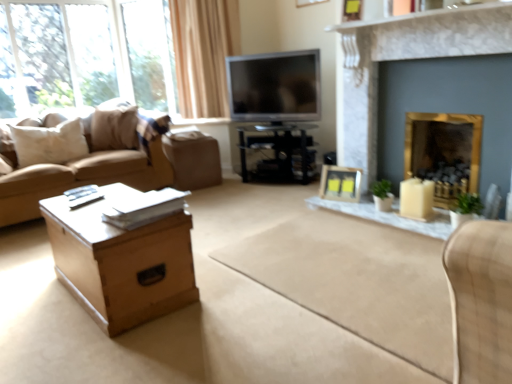
Question: From a real-world perspective, is black glossy tv stand at center, the 1th table in the back-to-front sequence, below light brown wooden table at lower left, which is the second table from top to bottom?

Choices:
 (A) yes
 (B) no

Answer: (B)

Question: Considering the relative sizes of black glossy tv stand at center, acting as the 2th table starting from the left, and light brown wooden table at lower left, marked as the 2th table in a right-to-left arrangement, in the image provided, is black glossy tv stand at center, acting as the 2th table starting from the left, shorter than light brown wooden table at lower left, marked as the 2th table in a right-to-left arrangement,?

Choices:
 (A) no
 (B) yes

Answer: (A)

Question: Does black glossy tv stand at center, the 1th table from the top, have a smaller size compared to light brown wooden table at lower left, which is the first table in bottom-to-top order?

Choices:
 (A) yes
 (B) no

Answer: (B)

Question: Is black glossy tv stand at center, the 1th table positioned from the right, wider than light brown wooden table at lower left, which is the second table from top to bottom?

Choices:
 (A) yes
 (B) no

Answer: (A)

Question: Does black glossy tv stand at center, the 2th table in the bottom-to-top sequence, come in front of light brown wooden table at lower left, marked as the first table in a front-to-back arrangement?

Choices:
 (A) yes
 (B) no

Answer: (B)

Question: From a real-world perspective, is black glossy tv stand at center, the 1th table in the back-to-front sequence, physically above light brown wooden table at lower left, marked as the first table in a front-to-back arrangement?

Choices:
 (A) no
 (B) yes

Answer: (B)

Question: From a real-world perspective, is gold metallic fireplace at right, the second fireplace in the front-to-back sequence, below gold marble fireplace at upper right, which is counted as the 1th fireplace, starting from the front?

Choices:
 (A) no
 (B) yes

Answer: (B)

Question: Does gold metallic fireplace at right, the second fireplace in the front-to-back sequence, have a greater width compared to gold marble fireplace at upper right, the 2th fireplace when ordered from back to front?

Choices:
 (A) yes
 (B) no

Answer: (A)

Question: From the image's perspective, is gold metallic fireplace at right, which is the 1th fireplace in back-to-front order, below gold marble fireplace at upper right, which is counted as the 1th fireplace, starting from the front?

Choices:
 (A) yes
 (B) no

Answer: (A)

Question: Is gold metallic fireplace at right, the second fireplace in the front-to-back sequence, oriented away from gold marble fireplace at upper right, which is counted as the 1th fireplace, starting from the front?

Choices:
 (A) no
 (B) yes

Answer: (A)

Question: Considering the relative sizes of gold metallic fireplace at right, which is the 1th fireplace in back-to-front order, and gold marble fireplace at upper right, which is counted as the 1th fireplace, starting from the front, in the image provided, is gold metallic fireplace at right, which is the 1th fireplace in back-to-front order, bigger than gold marble fireplace at upper right, which is counted as the 1th fireplace, starting from the front,?

Choices:
 (A) no
 (B) yes

Answer: (A)

Question: Is gold metallic fireplace at right, the second fireplace in the front-to-back sequence, thinner than gold marble fireplace at upper right, which is counted as the 1th fireplace, starting from the front?

Choices:
 (A) yes
 (B) no

Answer: (B)

Question: Is black glossy tv stand at center, the 1th table positioned from the right, at the right side of wooden picture frame at upper center, which is counted as the second picture frame, starting from the bottom?

Choices:
 (A) yes
 (B) no

Answer: (B)